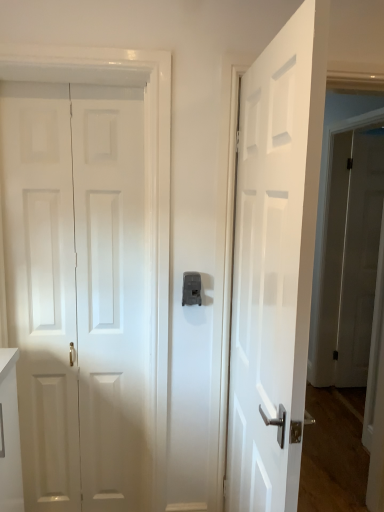
Question: Is white glossy door at center, the 2th door viewed from the left, looking in the opposite direction of white matte door at left, which ranks as the 3th door in right-to-left order?

Choices:
 (A) no
 (B) yes

Answer: (B)

Question: Is the position of white glossy door at center, the 2th door viewed from the left, more distant than that of white matte door at left, positioned as the first door in left-to-right order?

Choices:
 (A) no
 (B) yes

Answer: (A)

Question: Are white glossy door at center, which is the first door from front to back, and white matte door at left, marked as the second door in a back-to-front arrangement, making contact?

Choices:
 (A) yes
 (B) no

Answer: (B)

Question: Is white glossy door at center, which is the first door from front to back, smaller than white matte door at left, which ranks as the 3th door in right-to-left order?

Choices:
 (A) yes
 (B) no

Answer: (B)

Question: From the image's perspective, is white glossy door at center, the 3th door positioned from the back, below white matte door at left, positioned as the 2th door in front-to-back order?

Choices:
 (A) no
 (B) yes

Answer: (B)

Question: Would you say white matte door at left, which ranks as the 3th door in right-to-left order, is part of white glossy door at center, the 3th door positioned from the back,'s contents?

Choices:
 (A) no
 (B) yes

Answer: (A)

Question: Does white glossy door at right, which ranks as the 3th door in left-to-right order, have a larger size compared to white glossy door at center, the 2th door viewed from the left?

Choices:
 (A) no
 (B) yes

Answer: (A)

Question: From a real-world perspective, does white glossy door at right, placed as the 1th door when sorted from back to front, sit lower than white glossy door at center, the 2th door from the right?

Choices:
 (A) yes
 (B) no

Answer: (A)

Question: From a real-world perspective, is white glossy door at right, positioned as the 3th door in front-to-back order, over white glossy door at center, the 2th door from the right?

Choices:
 (A) yes
 (B) no

Answer: (B)

Question: Does white glossy door at right, the first door from the right, turn towards white glossy door at center, the 3th door positioned from the back?

Choices:
 (A) yes
 (B) no

Answer: (B)

Question: From the image's perspective, would you say white glossy door at right, the first door from the right, is shown under white glossy door at center, the 2th door from the right?

Choices:
 (A) no
 (B) yes

Answer: (A)

Question: Is white glossy door at right, which ranks as the 3th door in left-to-right order, surrounding white glossy door at center, the 2th door from the right?

Choices:
 (A) yes
 (B) no

Answer: (B)

Question: From the image's perspective, is white glossy door at right, placed as the 1th door when sorted from back to front, under white matte door at left, marked as the second door in a back-to-front arrangement?

Choices:
 (A) yes
 (B) no

Answer: (B)